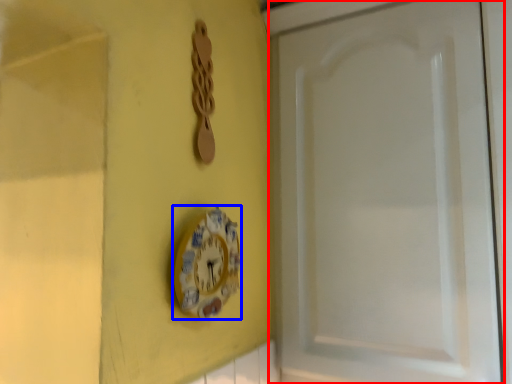
Question: Which object appears closest to the camera in this image, screen door (highlighted by a red box) or wall clock (highlighted by a blue box)?

Choices:
 (A) screen door
 (B) wall clock

Answer: (B)